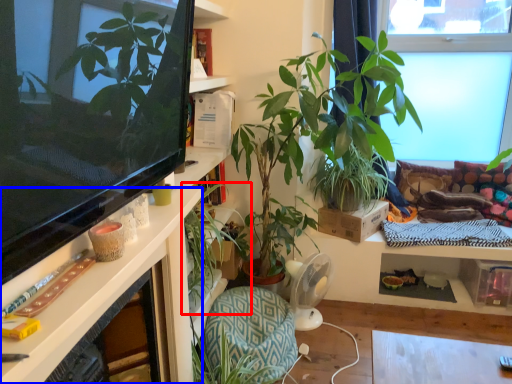
Question: Which object is closer to the camera taking this photo, houseplant (highlighted by a red box) or desk (highlighted by a blue box)?

Choices:
 (A) houseplant
 (B) desk

Answer: (B)